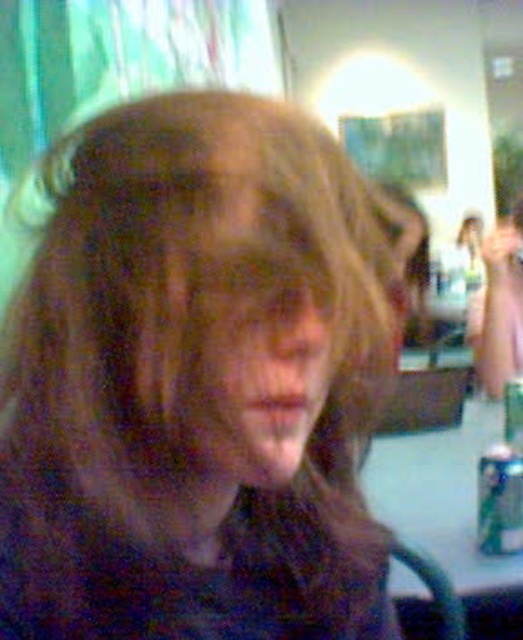
Measure the distance between brown matte hair at center and green matte can at lower right.

brown matte hair at center is 79.60 centimeters away from green matte can at lower right.

Is brown matte hair at center smaller than green matte can at lower right?

Actually, brown matte hair at center might be larger than green matte can at lower right.

Between point (138, 188) and point (497, 506), which one is positioned in front?

Point (138, 188) is in front.

The width and height of the screenshot is (523, 640). I want to click on brown matte hair at center, so click(x=198, y=381).

Who is positioned more to the left, smooth skin face at center or green matte can at lower right?

Positioned to the left is smooth skin face at center.

Can you confirm if smooth skin face at center is bigger than green matte can at lower right?

Incorrect, smooth skin face at center is not larger than green matte can at lower right.

Is point (288, 349) positioned in front of point (491, 547)?

Yes.

Find the location of `smooth skin face at center`. smooth skin face at center is located at coordinates (266, 374).

Which of these two, brown matte hair at center or smooth skin face at center, stands taller?

brown matte hair at center

What do you see at coordinates (198, 381) in the screenshot?
I see `brown matte hair at center` at bounding box center [198, 381].

Does point (309, 116) come behind point (283, 388)?

Yes, point (309, 116) is behind point (283, 388).

Where is `brown matte hair at center`? The image size is (523, 640). brown matte hair at center is located at coordinates (198, 381).